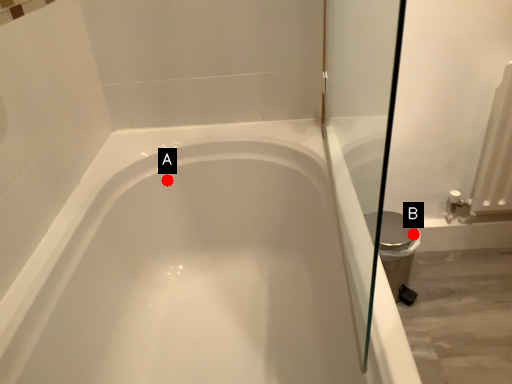
Question: Two points are circled on the image, labeled by A and B beside each circle. Which of the following is the closest to the observer?

Choices:
 (A) A is closer
 (B) B is closer

Answer: (A)